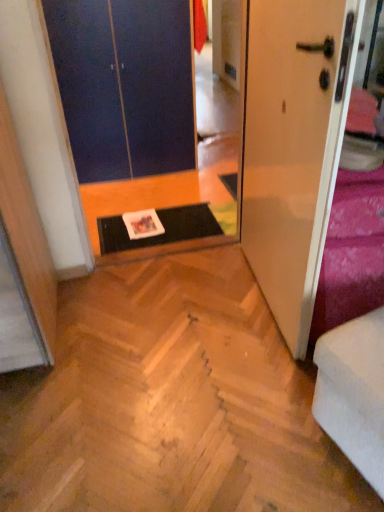
Question: From a real-world perspective, is white glossy door at right, the first door viewed from the front, over natural wood parquet floor at center?

Choices:
 (A) no
 (B) yes

Answer: (B)

Question: Is white glossy door at right, the first door viewed from the front, aimed at natural wood parquet floor at center?

Choices:
 (A) yes
 (B) no

Answer: (A)

Question: From the image's perspective, is white glossy door at right, the second door from the back, below natural wood parquet floor at center?

Choices:
 (A) yes
 (B) no

Answer: (B)

Question: Is white glossy door at right, the 1th door from the right, oriented away from natural wood parquet floor at center?

Choices:
 (A) no
 (B) yes

Answer: (A)

Question: Does white glossy door at right, the 1th door from the right, have a lesser width compared to natural wood parquet floor at center?

Choices:
 (A) no
 (B) yes

Answer: (B)

Question: Is white glossy door at right, the 1th door from the right, shorter than natural wood parquet floor at center?

Choices:
 (A) yes
 (B) no

Answer: (B)

Question: Is blue matte door at upper left, which ranks as the 2th door in right-to-left order, not inside black rubber doormat at center?

Choices:
 (A) no
 (B) yes

Answer: (B)

Question: From the image's perspective, is blue matte door at upper left, which ranks as the 2th door in right-to-left order, located beneath black rubber doormat at center?

Choices:
 (A) no
 (B) yes

Answer: (A)

Question: Is black rubber doormat at center surrounded by blue matte door at upper left, which ranks as the 2th door in right-to-left order?

Choices:
 (A) yes
 (B) no

Answer: (B)

Question: Considering the relative sizes of blue matte door at upper left, the first door viewed from the back, and black rubber doormat at center in the image provided, is blue matte door at upper left, the first door viewed from the back, shorter than black rubber doormat at center?

Choices:
 (A) yes
 (B) no

Answer: (B)

Question: From the image's perspective, is blue matte door at upper left, the first door viewed from the left, above black rubber doormat at center?

Choices:
 (A) yes
 (B) no

Answer: (A)

Question: Are blue matte door at upper left, the first door viewed from the left, and black rubber doormat at center located far from each other?

Choices:
 (A) yes
 (B) no

Answer: (B)

Question: Is natural wood parquet floor at center positioned with its back to velvet purple bedding at right?

Choices:
 (A) yes
 (B) no

Answer: (B)